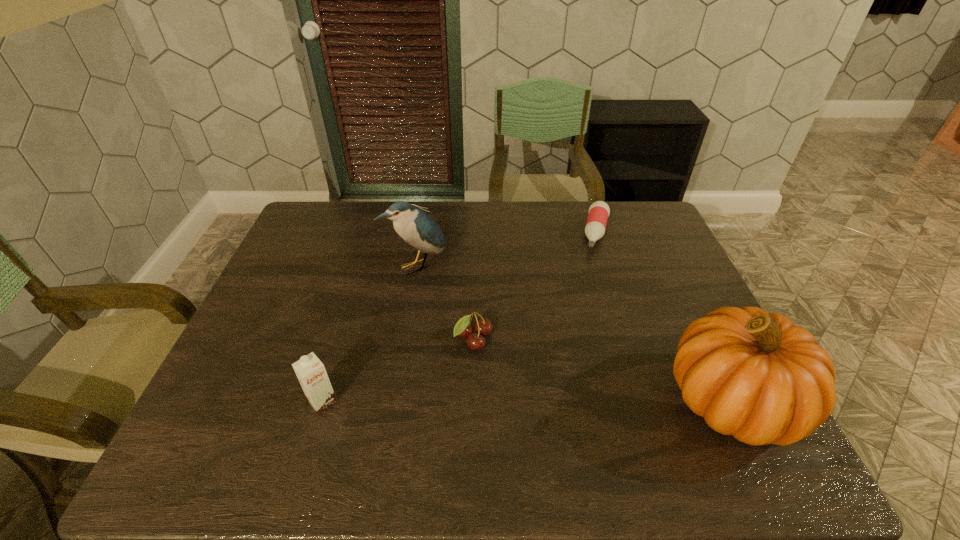
Identify the location of vacant space located 0.240m with the cap open on the bottle. The image size is (960, 540). (588, 306).

Identify the location of free space located 0.080m with the cap open on the bottle. The height and width of the screenshot is (540, 960). (595, 269).

Image resolution: width=960 pixels, height=540 pixels. What are the coordinates of `vacant space located 0.350m at the tip of the bird's beak` in the screenshot? It's located at 502,355.

You are a GUI agent. You are given a task and a screenshot of the screen. Output one action in this format:
    pyautogui.click(x=<x>, y=<y>)
    Task: Click on the free space located at the tip of the bird's beak
    
    Given the screenshot: What is the action you would take?
    pyautogui.click(x=502, y=355)

Where is `vacant space located at the tip of the bird's beak`? This screenshot has width=960, height=540. vacant space located at the tip of the bird's beak is located at coordinates (505, 358).

Locate an element on the screen. vacant space located 0.150m on the leaves of the third object from left to right is located at coordinates (527, 391).

The width and height of the screenshot is (960, 540). I want to click on vacant area situated on the leaves of the third object from left to right, so tap(502, 367).

The width and height of the screenshot is (960, 540). Find the location of `free space located on the leaves of the third object from left to right`. free space located on the leaves of the third object from left to right is located at coordinates (524, 388).

In order to click on object present at the far edge in this screenshot , I will do coord(599,211).

You are a GUI agent. You are given a task and a screenshot of the screen. Output one action in this format:
    pyautogui.click(x=<x>, y=<y>)
    Task: Click on the chocolate milk present at the near edge
    Image resolution: width=960 pixels, height=540 pixels.
    Given the screenshot: What is the action you would take?
    pyautogui.click(x=311, y=373)